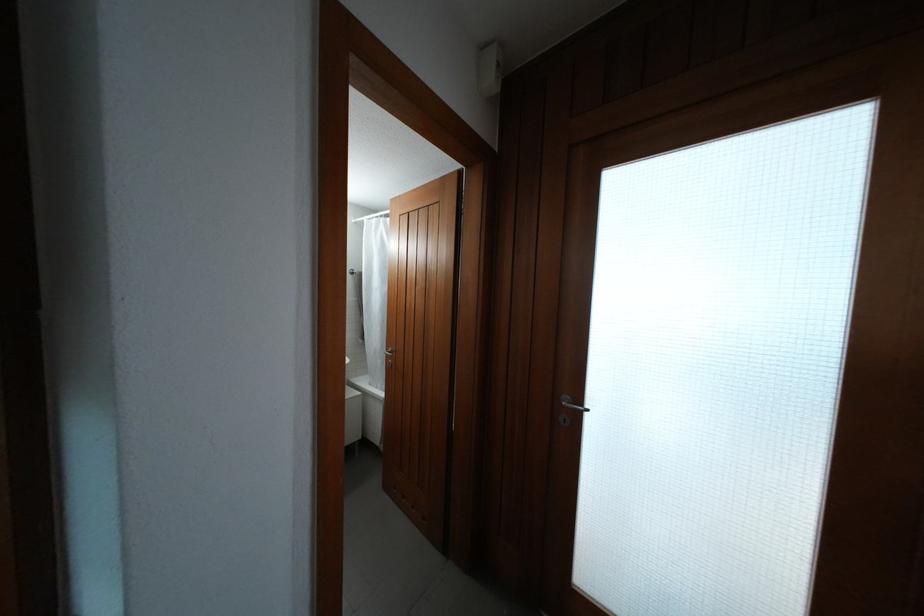
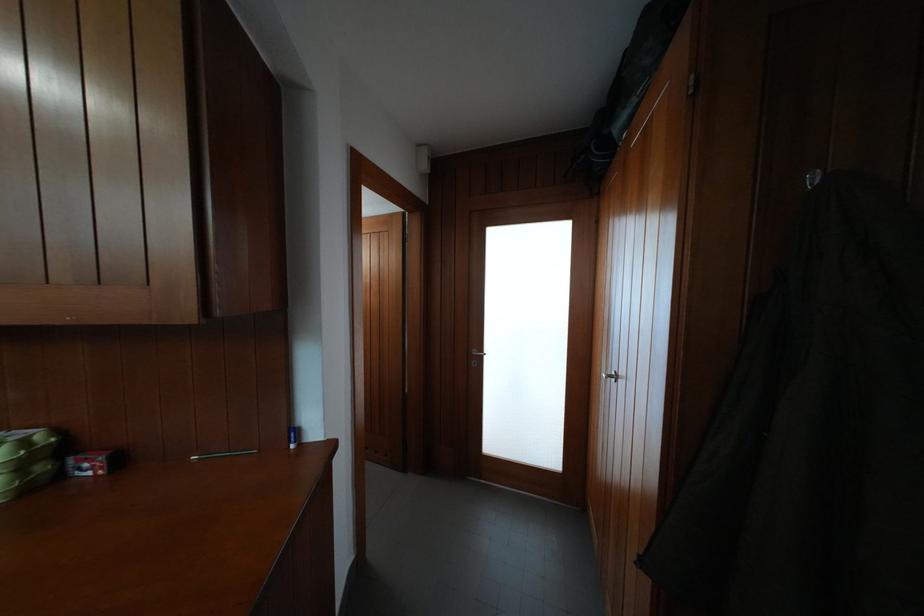
Question: The first image is from the beginning of the video and the second image is from the end. How did the camera likely rotate when shooting the video?

Choices:
 (A) Left
 (B) Right
 (C) Up
 (D) Down

Answer: (B)